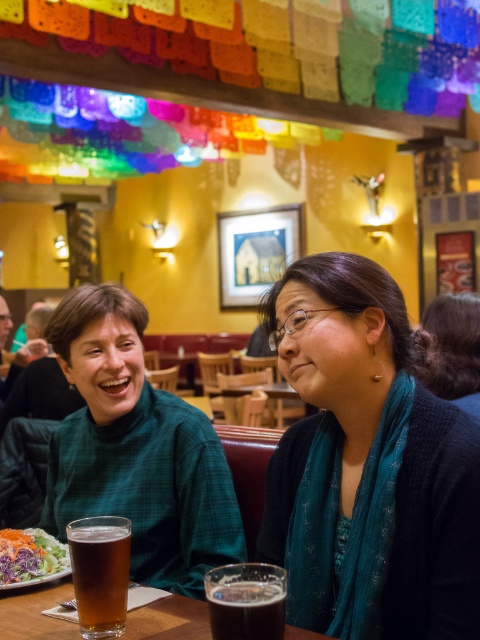
You are a customer sitting at the table in the image and want to grab the green plaid turtleneck sweater at center. Can you reach it without getting up?

The green plaid turtleneck sweater at center is 4.15 feet away from viewer, so you cannot reach it without getting up since it is too far.